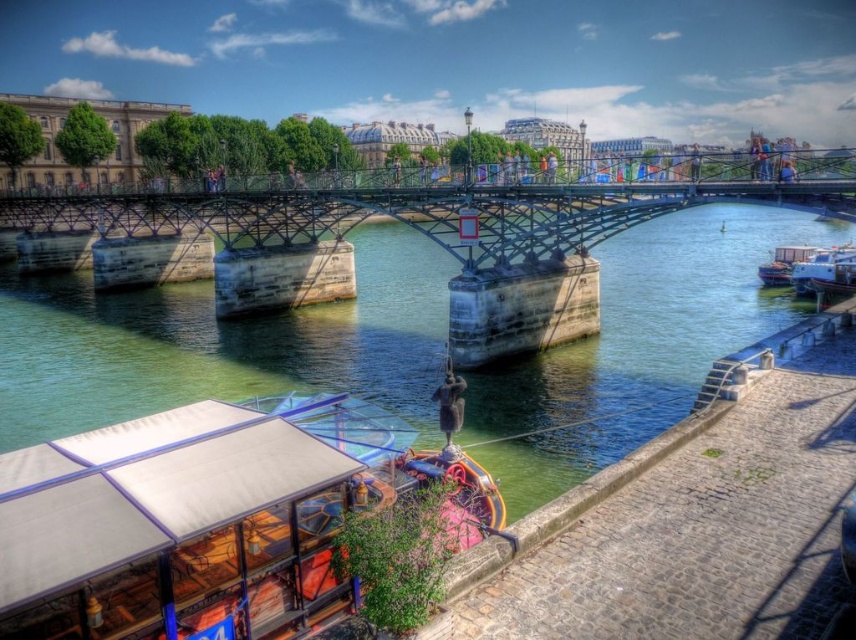
Which is more to the right, wooden boat at lower left or white wooden boat at right?

Positioned to the right is white wooden boat at right.

Who is positioned more to the left, wooden boat at lower left or white wooden boat at right?

Positioned to the left is wooden boat at lower left.

Which is in front, point (201, 464) or point (819, 289)?

Positioned in front is point (201, 464).

Find the location of a particular element. wooden boat at lower left is located at coordinates (207, 518).

Can you confirm if white wooden boat at right is positioned below white glossy boat at right?

Correct, white wooden boat at right is located below white glossy boat at right.

Which is behind, point (847, 262) or point (782, 250)?

Positioned behind is point (782, 250).

Is point (835, 282) positioned after point (798, 250)?

No, it is in front of (798, 250).

The image size is (856, 640). What are the coordinates of `white wooden boat at right` in the screenshot? It's located at (x=824, y=269).

Does wooden boat at lower left appear on the right side of white glossy boat at right?

In fact, wooden boat at lower left is to the left of white glossy boat at right.

Is point (169, 442) closer to camera compared to point (758, 272)?

Yes, point (169, 442) is in front of point (758, 272).

The width and height of the screenshot is (856, 640). Find the location of `wooden boat at lower left`. wooden boat at lower left is located at coordinates (207, 518).